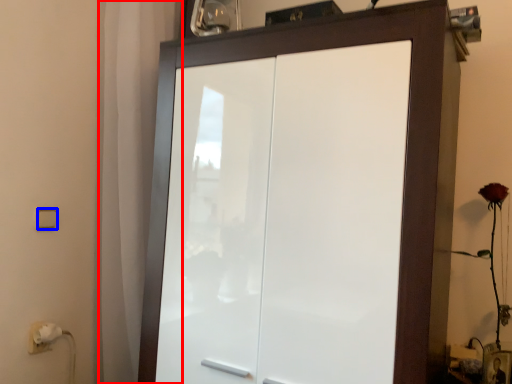
Question: Which object appears farthest to the camera in this image, curtain (highlighted by a red box) or light switch (highlighted by a blue box)?

Choices:
 (A) curtain
 (B) light switch

Answer: (A)